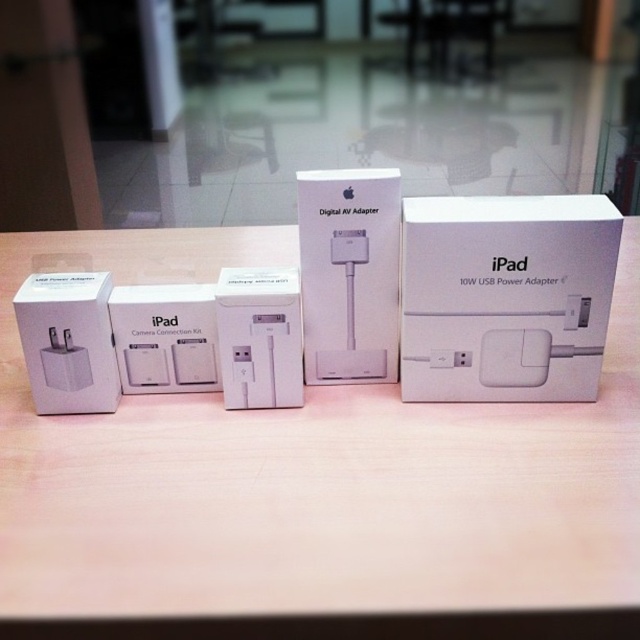
Question: Estimate the real-world distances between objects in this image. Which object is farther from the white matte table at center?

Choices:
 (A) white matte ipad power adapter at center
 (B) white matte digital av adapter at center

Answer: (B)

Question: Which object is the closest to the white matte ipad camera connection kit at left?

Choices:
 (A) white matte ipad power adapter at center
 (B) white matte power adapter at left
 (C) white matte table at center

Answer: (B)

Question: Can you confirm if white matte wii at center is positioned below white matte ipad camera connection kit at left?

Choices:
 (A) yes
 (B) no

Answer: (A)

Question: Which of the following is the farthest from the observer?

Choices:
 (A) (531, 518)
 (B) (208, 381)
 (C) (545, 355)

Answer: (B)

Question: Observing the image, what is the correct spatial positioning of white matte ipad power adapter at center in reference to white matte power adapter at left?

Choices:
 (A) below
 (B) above

Answer: (B)

Question: Does white matte table at center lie in front of white matte digital av adapter at center?

Choices:
 (A) no
 (B) yes

Answer: (B)